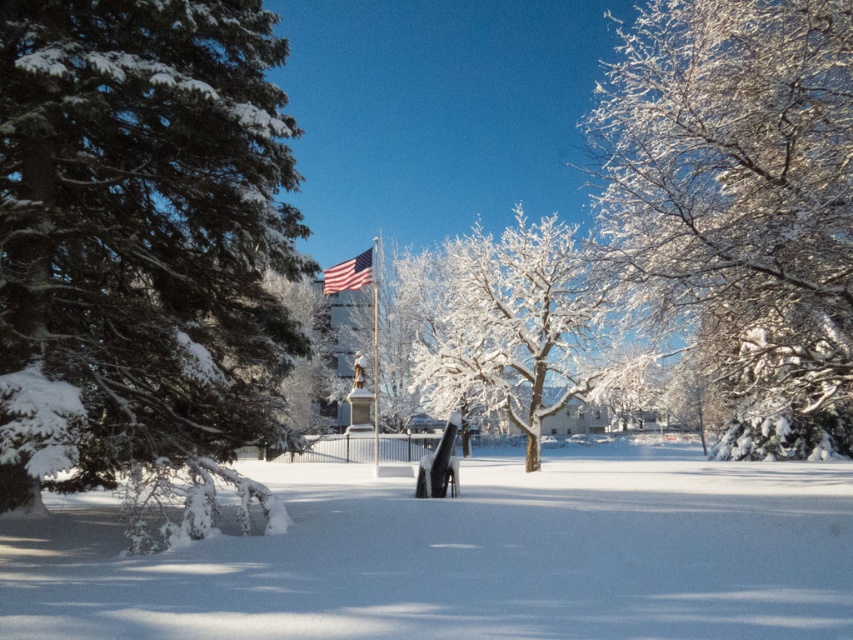
Who is more forward, (x=325, y=288) or (x=374, y=257)?

Point (x=325, y=288) is in front.

Describe the element at coordinates (349, 273) in the screenshot. This screenshot has width=853, height=640. I see `american flag at center` at that location.

Where is `american flag at center`? This screenshot has height=640, width=853. american flag at center is located at coordinates (349, 273).

Does snow-covered evergreen tree at left lie behind white frosty branches at upper right?

No.

Based on the photo, between snow-covered evergreen tree at left and white frosty branches at upper right, which one appears on the right side from the viewer's perspective?

Positioned to the right is white frosty branches at upper right.

Is point (270, 145) positioned after point (730, 445)?

That is False.

Where is `snow-covered evergreen tree at left`? This screenshot has width=853, height=640. snow-covered evergreen tree at left is located at coordinates (143, 252).

From the picture: Is white fluffy snow at center bigger than american flag at center?

Indeed, white fluffy snow at center has a larger size compared to american flag at center.

Can you confirm if white fluffy snow at center is positioned above american flag at center?

Incorrect, white fluffy snow at center is not positioned above american flag at center.

The image size is (853, 640). I want to click on white fluffy snow at center, so 465,556.

At what (x,y) coordinates should I click in order to perform the action: click on white fluffy snow at center. Please return your answer as a coordinate pair (x, y). This screenshot has height=640, width=853. Looking at the image, I should click on (465, 556).